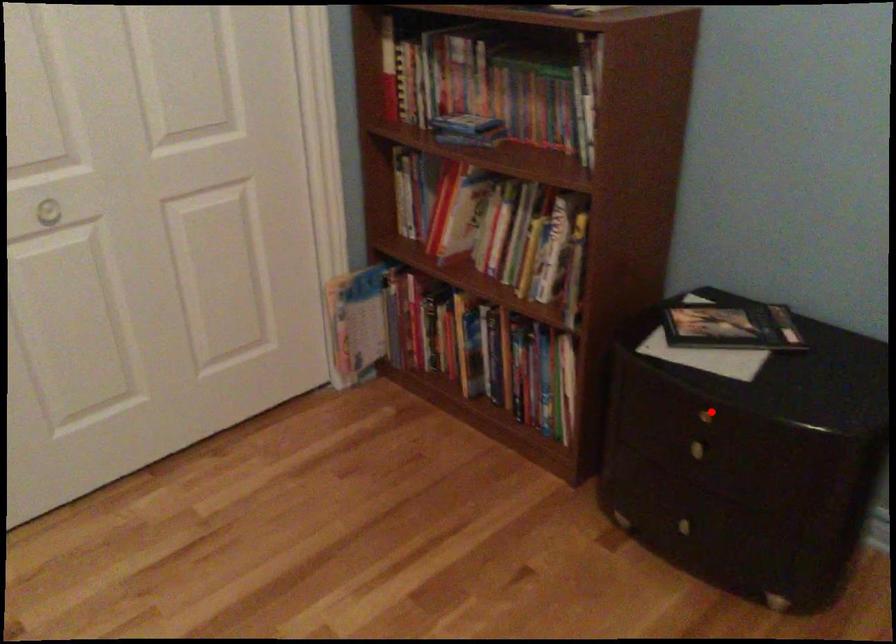
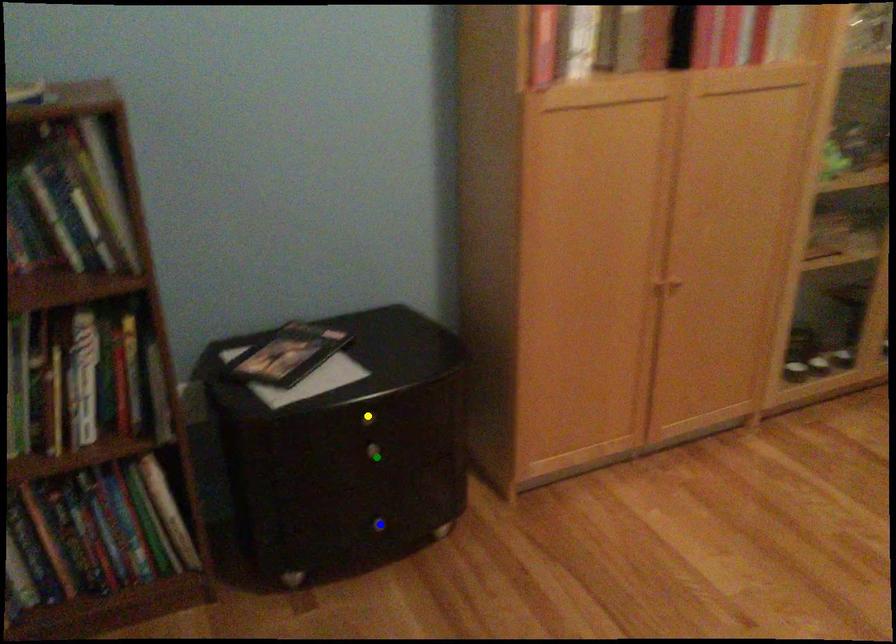
Question: I am providing you with two images of the same scene from different viewpoints. A red point is marked on the first image. You are given multiple points on the second image. In image 2, which mark is for the same physical point as the one in image 1?

Choices:
 (A) green point
 (B) yellow point
 (C) blue point

Answer: (B)